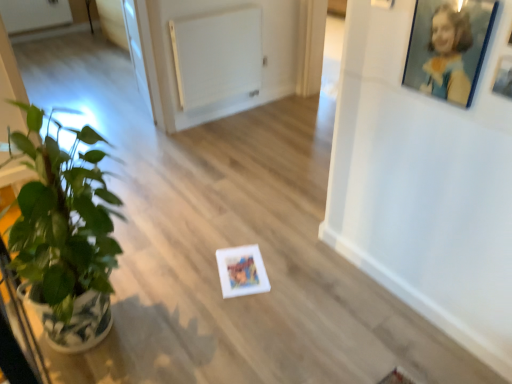
Question: Is the depth of blue glossy picture frame at upper right, the second picture frame when ordered from right to left, less than that of green glossy houseplant at left?

Choices:
 (A) yes
 (B) no

Answer: (B)

Question: Does blue glossy picture frame at upper right, which is the 1th picture frame from left to right, have a lesser width compared to green glossy houseplant at left?

Choices:
 (A) yes
 (B) no

Answer: (A)

Question: From a real-world perspective, is blue glossy picture frame at upper right, the second picture frame when ordered from right to left, below green glossy houseplant at left?

Choices:
 (A) yes
 (B) no

Answer: (B)

Question: Does blue glossy picture frame at upper right, which is the 1th picture frame from left to right, have a larger size compared to green glossy houseplant at left?

Choices:
 (A) yes
 (B) no

Answer: (B)

Question: Does blue glossy picture frame at upper right, which is the 1th picture frame from left to right, contain green glossy houseplant at left?

Choices:
 (A) no
 (B) yes

Answer: (A)

Question: From their relative heights in the image, would you say blue glossy picture frame at upper right, the second picture frame when ordered from right to left, is taller or shorter than white matte picture frame at upper right, placed as the first picture frame when sorted from right to left?

Choices:
 (A) short
 (B) tall

Answer: (B)

Question: From a real-world perspective, is blue glossy picture frame at upper right, which is the 1th picture frame from left to right, positioned above or below white matte picture frame at upper right, placed as the first picture frame when sorted from right to left?

Choices:
 (A) below
 (B) above

Answer: (B)

Question: Would you say blue glossy picture frame at upper right, which is the 1th picture frame from left to right, is to the left or to the right of white matte picture frame at upper right, placed as the first picture frame when sorted from right to left, in the picture?

Choices:
 (A) left
 (B) right

Answer: (A)

Question: Looking at their shapes, would you say blue glossy picture frame at upper right, the second picture frame when ordered from right to left, is wider or thinner than white matte picture frame at upper right, placed as the first picture frame when sorted from right to left?

Choices:
 (A) thin
 (B) wide

Answer: (B)

Question: From the image's perspective, is blue glossy picture frame at upper right, the second picture frame when ordered from right to left, above or below white matte radiator at upper center?

Choices:
 (A) below
 (B) above

Answer: (A)

Question: Considering the positions of blue glossy picture frame at upper right, which is the 1th picture frame from left to right, and white matte radiator at upper center in the image, is blue glossy picture frame at upper right, which is the 1th picture frame from left to right, taller or shorter than white matte radiator at upper center?

Choices:
 (A) short
 (B) tall

Answer: (A)

Question: Is blue glossy picture frame at upper right, which is the 1th picture frame from left to right, in front of or behind white matte radiator at upper center in the image?

Choices:
 (A) front
 (B) behind

Answer: (A)

Question: Is blue glossy picture frame at upper right, which is the 1th picture frame from left to right, wider or thinner than white matte radiator at upper center?

Choices:
 (A) thin
 (B) wide

Answer: (A)

Question: Is point (139, 79) closer or farther from the camera than point (410, 34)?

Choices:
 (A) closer
 (B) farther

Answer: (B)

Question: Considering the relative positions of transparent glass door at upper left and blue glossy picture frame at upper right, the second picture frame when ordered from right to left, in the image provided, is transparent glass door at upper left to the left or to the right of blue glossy picture frame at upper right, the second picture frame when ordered from right to left,?

Choices:
 (A) right
 (B) left

Answer: (B)